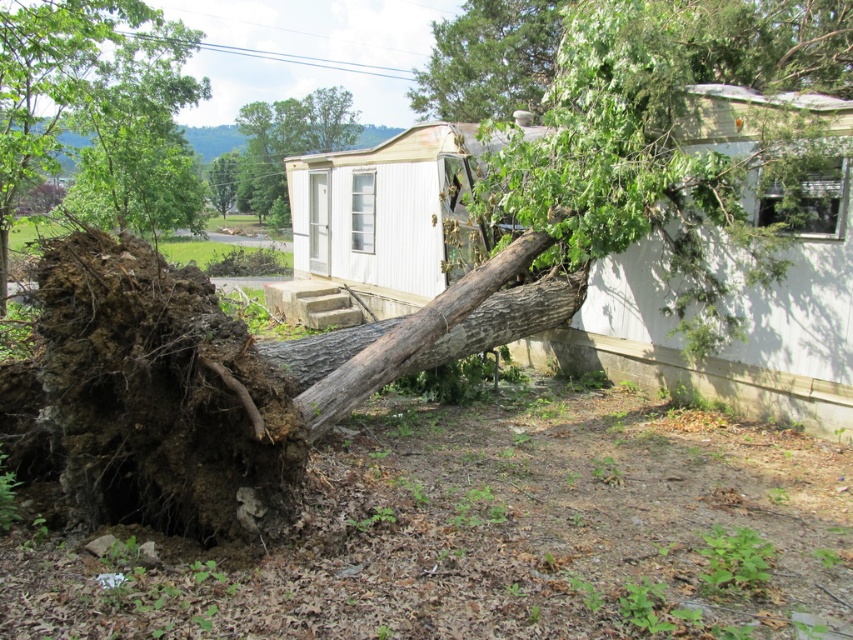
You are a disaster assessment specialist inspecting the damage caused by the storm. You notice the brown rough wood at center and the green rough bark tree at upper center. Which object is smaller in size?

The brown rough wood at center is smaller in size compared to the green rough bark tree at upper center.

You are a disaster assessment specialist evaluating the scene. You need to prioritize which tree to inspect first based on their sizes. Which tree has a greater width between the brown rough bark tree at left and the green rough bark tree at upper center?

The brown rough bark tree at left has a greater width compared to the green rough bark tree at upper center, so it should be inspected first due to its larger size.